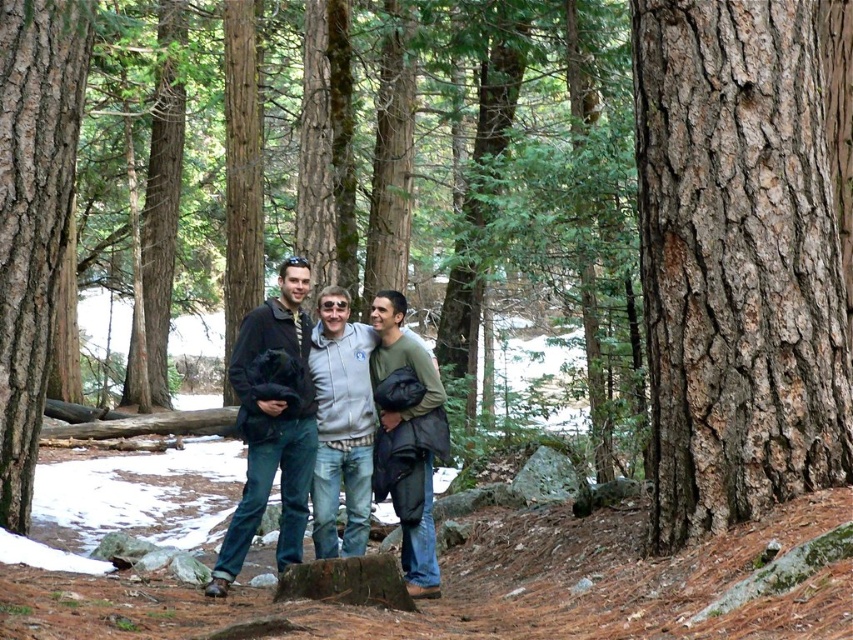
Is smooth brown bark at center shorter than gray fleece jacket at center?

No, smooth brown bark at center is not shorter than gray fleece jacket at center.

Consider the image. Between smooth brown bark at center and gray fleece jacket at center, which one appears on the right side from the viewer's perspective?

Positioned to the right is smooth brown bark at center.

Where is `smooth brown bark at center`? The image size is (853, 640). smooth brown bark at center is located at coordinates (735, 262).

Does point (737, 125) lie in front of point (303, 532)?

Yes.

In the scene shown: Does smooth brown bark at center come in front of matte black jacket at center?

Yes, it is.

Who is more distant from viewer, (x=721, y=516) or (x=215, y=566)?

Positioned behind is point (x=215, y=566).

You are a GUI agent. You are given a task and a screenshot of the screen. Output one action in this format:
    pyautogui.click(x=<x>, y=<y>)
    Task: Click on the smooth brown bark at center
    Image resolution: width=853 pixels, height=640 pixels.
    Given the screenshot: What is the action you would take?
    pyautogui.click(x=735, y=262)

Between smooth brown bark at left and matte black jacket at center, which one appears on the left side from the viewer's perspective?

From the viewer's perspective, smooth brown bark at left appears more on the left side.

Can you confirm if smooth brown bark at left is positioned to the left of matte black jacket at center?

Correct, you'll find smooth brown bark at left to the left of matte black jacket at center.

Locate an element on the screen. The image size is (853, 640). smooth brown bark at left is located at coordinates (33, 216).